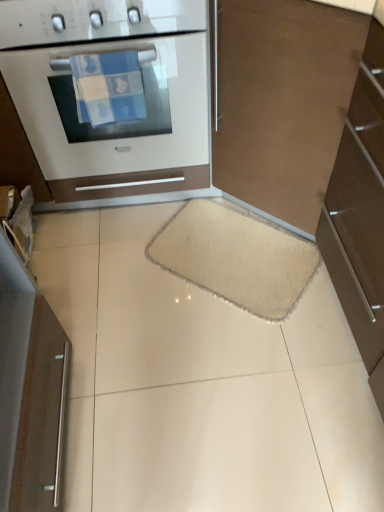
Question: Should I look upward or downward to see brown matte cabinet at right?

Choices:
 (A) up
 (B) down

Answer: (A)

Question: Does beige fuzzy mat at center have a lesser height compared to brown matte cabinet at right?

Choices:
 (A) yes
 (B) no

Answer: (A)

Question: Considering the relative sizes of beige fuzzy mat at center and brown matte cabinet at right in the image provided, is beige fuzzy mat at center bigger than brown matte cabinet at right?

Choices:
 (A) yes
 (B) no

Answer: (B)

Question: From a real-world perspective, is beige fuzzy mat at center under brown matte cabinet at right?

Choices:
 (A) no
 (B) yes

Answer: (B)

Question: Is beige fuzzy mat at center thinner than brown matte cabinet at right?

Choices:
 (A) no
 (B) yes

Answer: (A)

Question: From a real-world perspective, is beige fuzzy mat at center physically above brown matte cabinet at right?

Choices:
 (A) yes
 (B) no

Answer: (B)

Question: Does beige fuzzy mat at center have a smaller size compared to brown matte cabinet at right?

Choices:
 (A) no
 (B) yes

Answer: (B)

Question: Is white glossy oven at upper left aimed at brown matte cabinet at right?

Choices:
 (A) no
 (B) yes

Answer: (A)

Question: Does white glossy oven at upper left have a larger size compared to brown matte cabinet at right?

Choices:
 (A) yes
 (B) no

Answer: (A)

Question: Is white glossy oven at upper left to the left of brown matte cabinet at right from the viewer's perspective?

Choices:
 (A) yes
 (B) no

Answer: (A)

Question: Considering the relative sizes of white glossy oven at upper left and brown matte cabinet at right in the image provided, is white glossy oven at upper left smaller than brown matte cabinet at right?

Choices:
 (A) yes
 (B) no

Answer: (B)

Question: Does white glossy oven at upper left lie in front of brown matte cabinet at right?

Choices:
 (A) no
 (B) yes

Answer: (A)

Question: Can you confirm if white glossy oven at upper left is thinner than brown matte cabinet at right?

Choices:
 (A) no
 (B) yes

Answer: (A)

Question: Is brown matte cabinet at right to the right of white glossy oven at upper left from the viewer's perspective?

Choices:
 (A) no
 (B) yes

Answer: (B)